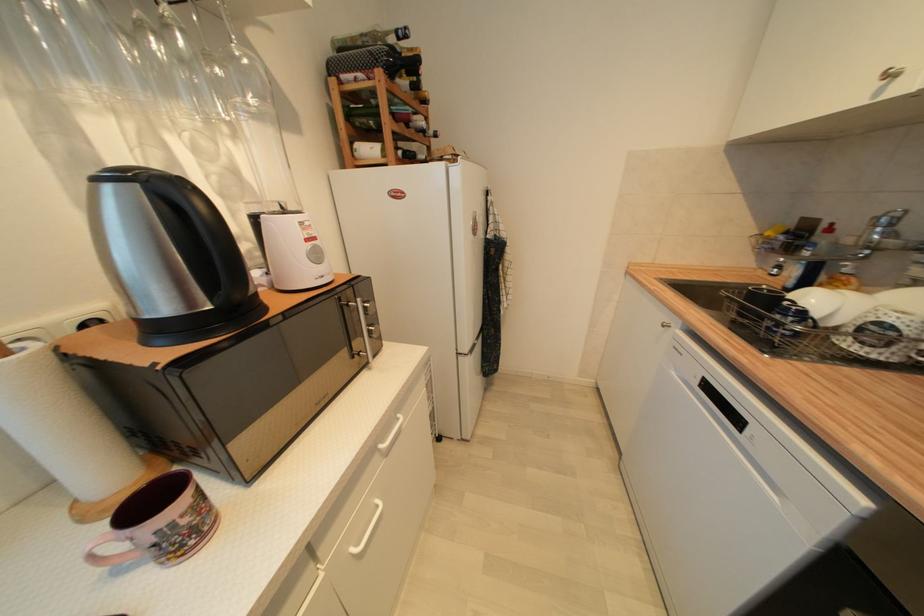
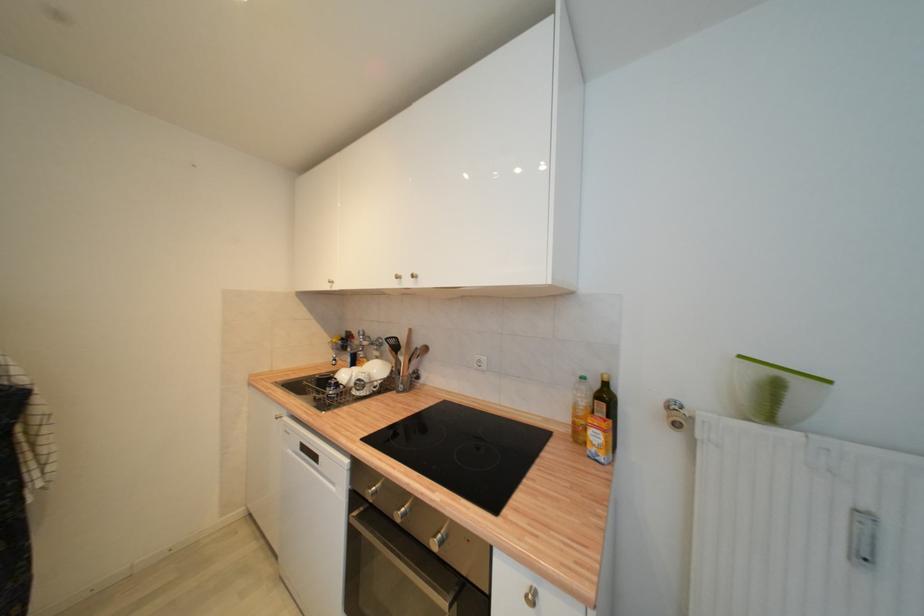
Question: How did the camera likely rotate?

Choices:
 (A) Left
 (B) Right
 (C) Up
 (D) Down

Answer: (B)